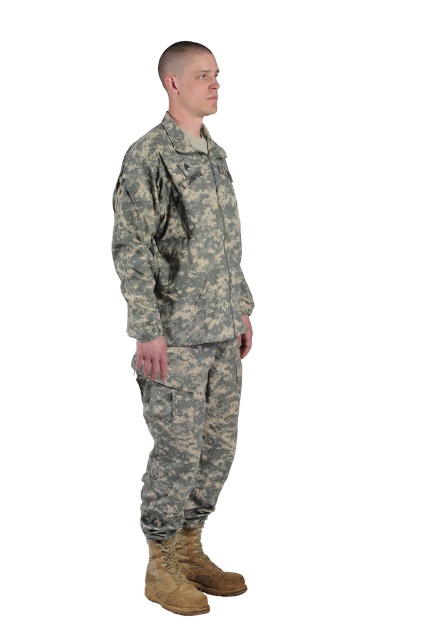
Who is more forward, [204,596] or [224,580]?

Point [204,596]

Can you confirm if tan suede boot at lower center is shorter than brown leather boot at lower center?

Indeed, tan suede boot at lower center has a lesser height compared to brown leather boot at lower center.

Measure the distance between tan suede boot at lower center and camera.

tan suede boot at lower center is 2.46 meters from camera.

Where is `tan suede boot at lower center`? This screenshot has width=425, height=640. tan suede boot at lower center is located at coordinates (170, 580).

Which of these two, camouflage fabric uniform at center or brown leather boot at lower center, stands shorter?

Standing shorter between the two is brown leather boot at lower center.

This screenshot has height=640, width=425. Find the location of `camouflage fabric uniform at center`. camouflage fabric uniform at center is located at coordinates (184, 324).

Does camouflage fabric uniform at center have a lesser height compared to tan suede boot at lower center?

Incorrect, camouflage fabric uniform at center's height does not fall short of tan suede boot at lower center's.

Locate an element on the screen. This screenshot has height=640, width=425. camouflage fabric uniform at center is located at coordinates (184, 324).